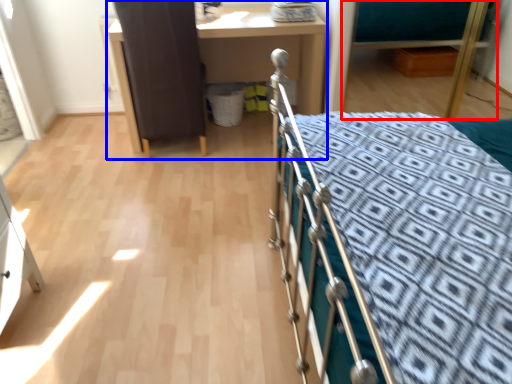
Question: Which object is further to the camera taking this photo, hospital bed (highlighted by a red box) or desk (highlighted by a blue box)?

Choices:
 (A) hospital bed
 (B) desk

Answer: (B)